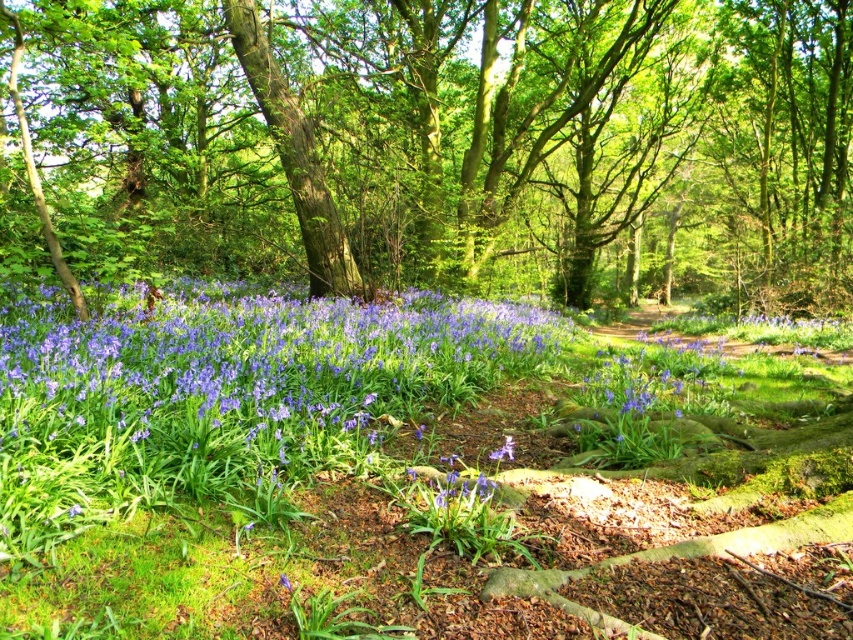
Question: Which of the following is the closest to the observer?

Choices:
 (A) pyautogui.click(x=419, y=372)
 (B) pyautogui.click(x=589, y=93)
 (C) pyautogui.click(x=289, y=580)

Answer: (C)

Question: Which object is positioned farthest from the green leafy tree at center?

Choices:
 (A) purple glossy flowers at lower left
 (B) blue matte flower at center

Answer: (B)

Question: Is purple glossy flowers at lower left smaller than blue matte flower at center?

Choices:
 (A) no
 (B) yes

Answer: (A)

Question: Is green leafy tree at center in front of blue matte flower at center?

Choices:
 (A) yes
 (B) no

Answer: (B)

Question: In this image, where is green leafy tree at center located relative to blue matte flower at center?

Choices:
 (A) above
 (B) below

Answer: (A)

Question: Which object is closer to the camera taking this photo?

Choices:
 (A) blue matte flower at center
 (B) green leafy tree at center
 (C) purple glossy flowers at lower left

Answer: (A)